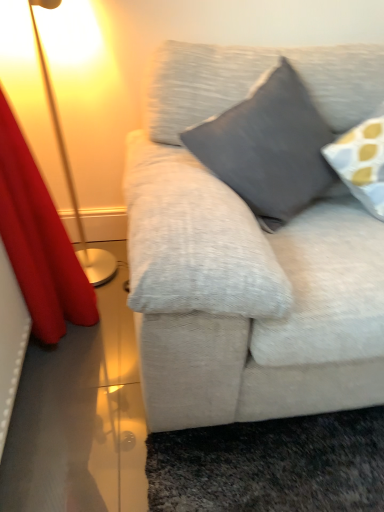
Identify the location of free spot to the right of red velvet curtain at left. This screenshot has width=384, height=512. (120, 350).